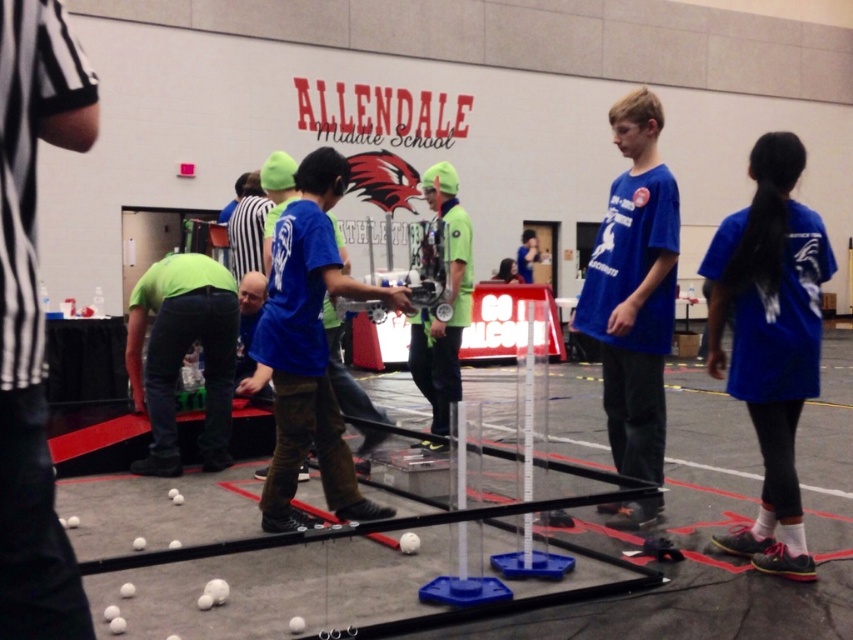
Who is more forward, (294, 346) or (233, 294)?

Point (294, 346)

From the picture: Is blue matte shirt at center positioned before green fabric referee at center?

Yes, it is in front of green fabric referee at center.

The height and width of the screenshot is (640, 853). Find the location of `blue matte shirt at center`. blue matte shirt at center is located at coordinates (309, 348).

Is black and white striped shirt at upper left smaller than blue fabric shirt at center?

Indeed, black and white striped shirt at upper left has a smaller size compared to blue fabric shirt at center.

The height and width of the screenshot is (640, 853). Identify the location of black and white striped shirt at upper left. (33, 317).

This screenshot has width=853, height=640. What are the coordinates of `black and white striped shirt at upper left` in the screenshot? It's located at (33, 317).

Is point (743, 340) positioned after point (221, 403)?

No, (743, 340) is in front of (221, 403).

This screenshot has width=853, height=640. In order to click on blue fabric shirt at center in this screenshot , I will do `click(770, 339)`.

Which is behind, point (741, 276) or point (212, 314)?

Point (212, 314)

Locate an element on the screen. blue fabric shirt at center is located at coordinates (770, 339).